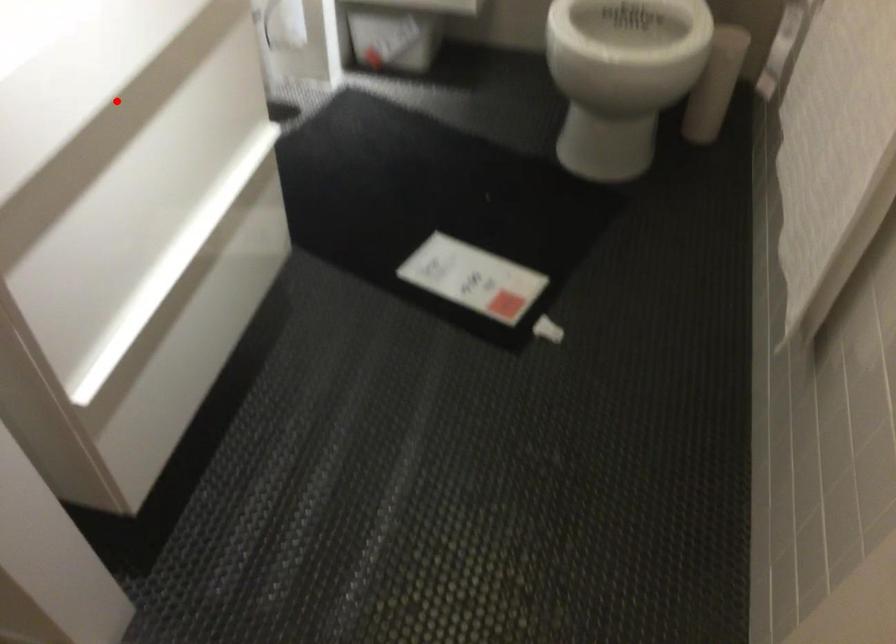
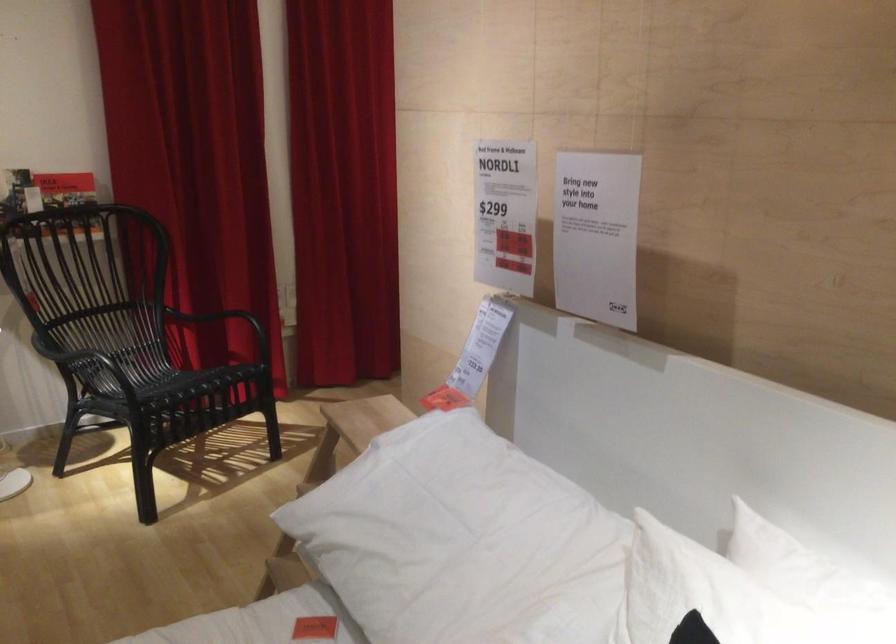
Question: I am providing you with two images of the same scene from different viewpoints. A red point is marked on the first image. At the location where the point appears in image 1, is it still visible in image 2?

Choices:
 (A) Yes
 (B) No

Answer: (B)